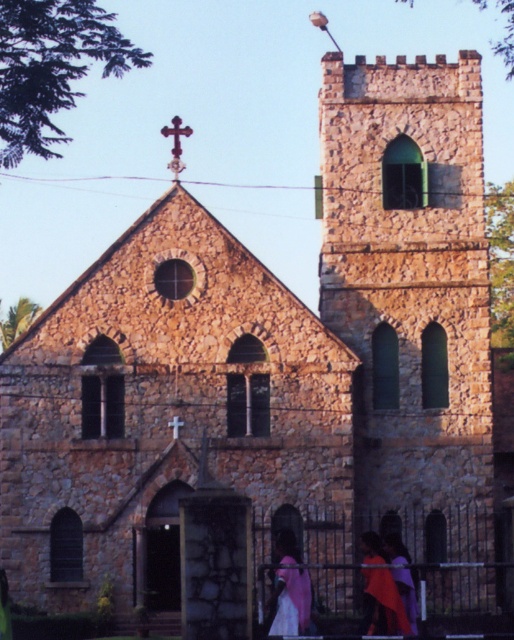
Question: Is stone tower at center to the right of pink fabric at center from the viewer's perspective?

Choices:
 (A) no
 (B) yes

Answer: (B)

Question: Is pink fabric at center smaller than silky purple dress at lower center?

Choices:
 (A) no
 (B) yes

Answer: (B)

Question: Which point is farther to the camera?

Choices:
 (A) silky purple dress at lower center
 (B) pink fabric at center
 (C) stone tower at center

Answer: (C)

Question: Does stone tower at center appear on the right side of silky purple dress at lower center?

Choices:
 (A) yes
 (B) no

Answer: (A)

Question: Which point is farther to the camera?

Choices:
 (A) stone tower at center
 (B) silky purple dress at lower center

Answer: (A)

Question: Which object appears farthest from the camera in this image?

Choices:
 (A) stone tower at center
 (B) pink fabric at center

Answer: (A)